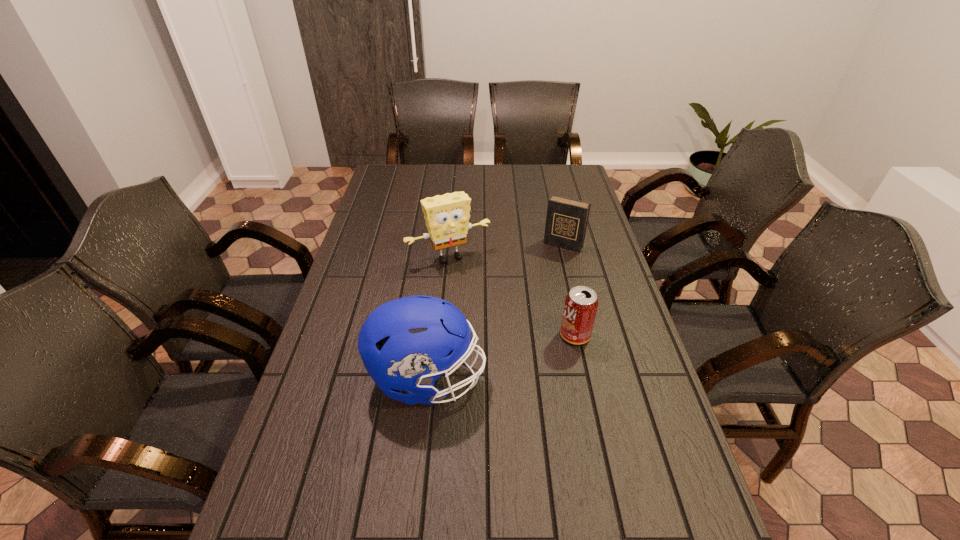
Find the location of a particular element. This screenshot has height=540, width=960. football helmet is located at coordinates (406, 344).

You are a GUI agent. You are given a task and a screenshot of the screen. Output one action in this format:
    pyautogui.click(x=<x>, y=<y>)
    Task: Click on the soda can
    This screenshot has width=960, height=540.
    Given the screenshot: What is the action you would take?
    pyautogui.click(x=580, y=307)

Image resolution: width=960 pixels, height=540 pixels. I want to click on sponge, so click(447, 216).

I want to click on diary, so click(x=566, y=222).

This screenshot has width=960, height=540. In order to click on vacant region located 0.100m on the front-facing side of the football helmet in this screenshot , I will do `click(524, 379)`.

This screenshot has width=960, height=540. Find the location of `free space located 0.330m on the left of the soda can`. free space located 0.330m on the left of the soda can is located at coordinates (444, 335).

Where is `free space located on the face of the sponge`? free space located on the face of the sponge is located at coordinates (507, 340).

Locate an element on the screen. This screenshot has width=960, height=540. blank space located on the face of the sponge is located at coordinates (498, 325).

Locate an element on the screen. vacant space located 0.300m on the face of the sponge is located at coordinates (501, 330).

The height and width of the screenshot is (540, 960). What are the coordinates of `vacant space situated 0.320m on the front cover of the diary` in the screenshot? It's located at (525, 311).